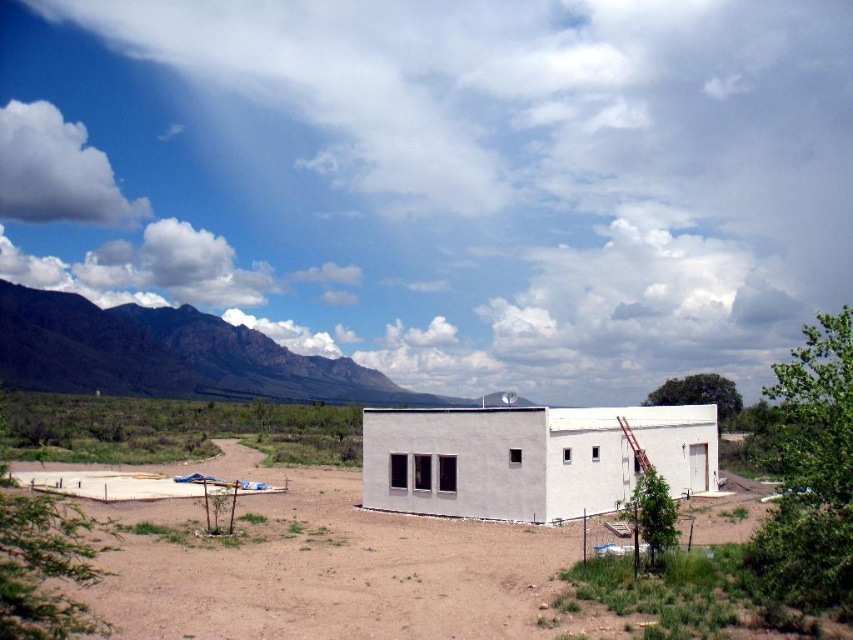
You are an architect planning to build a new structure that must be wider than the existing white smooth building at center. Given the landscape, can the gray rocky mountain at left be used as a reference for the minimum required width?

The white smooth building at center is narrower than the gray rocky mountain at left. Therefore, to meet the requirement of being wider than the existing white smooth building at center, the new structure must be at least as wide as the gray rocky mountain at left.

You are standing at the origin point in the image. Where is the dirt at center located in terms of 2D coordinates?

The dirt at center is located at the 2D coordinates of point (340, 570).